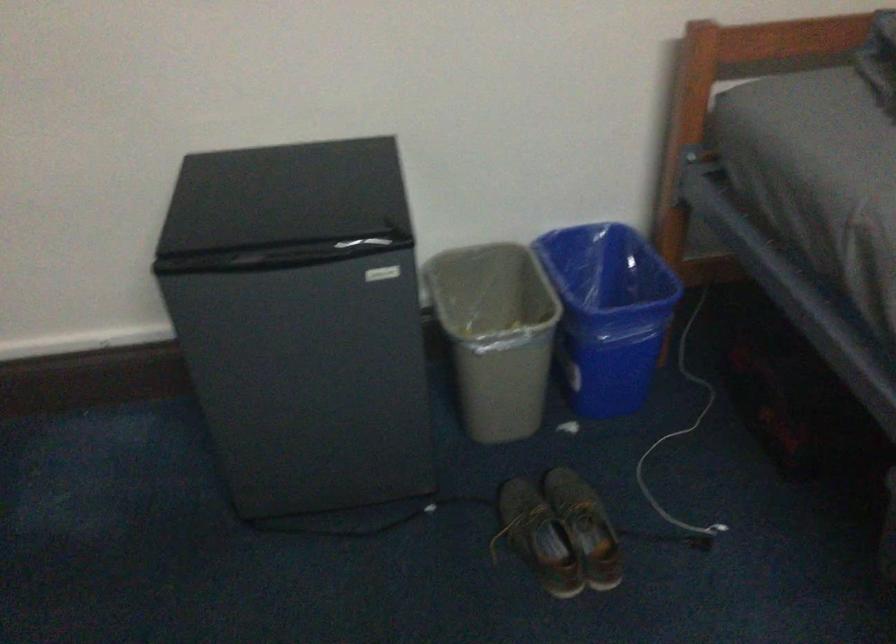
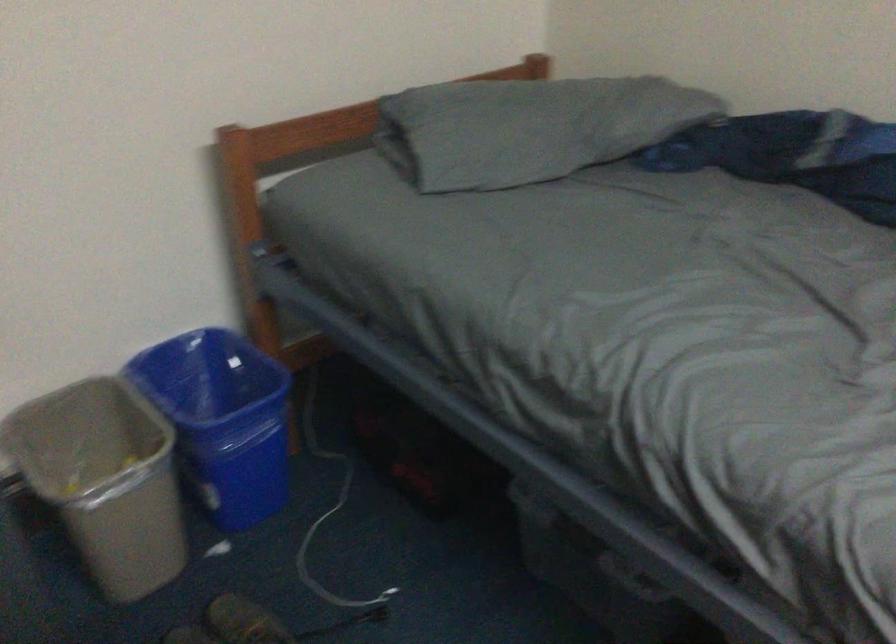
In the second image, find the point that corresponds to the point at 677,428 in the first image.

(328, 509)